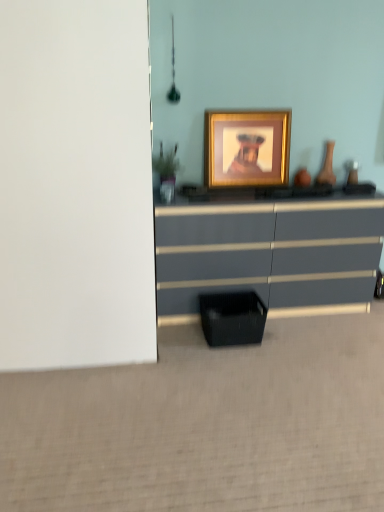
Question: From a real-world perspective, relative to matte brown vase at right, is green matte plant at left vertically above or below?

Choices:
 (A) above
 (B) below

Answer: (A)

Question: Looking at the image, does green matte plant at left seem bigger or smaller compared to matte brown vase at right?

Choices:
 (A) small
 (B) big

Answer: (B)

Question: Considering the real-world distances, which object is farthest from the black mesh basket at lower center?

Choices:
 (A) matte brown vase at right
 (B) green matte plant at left
 (C) matte gray chest of drawers at center
 (D) gold/glossy picture frame at center

Answer: (A)

Question: Estimate the real-world distances between objects in this image. Which object is farther from the gold/glossy picture frame at center?

Choices:
 (A) matte gray chest of drawers at center
 (B) black mesh basket at lower center
 (C) matte brown vase at right
 (D) green matte plant at left

Answer: (B)